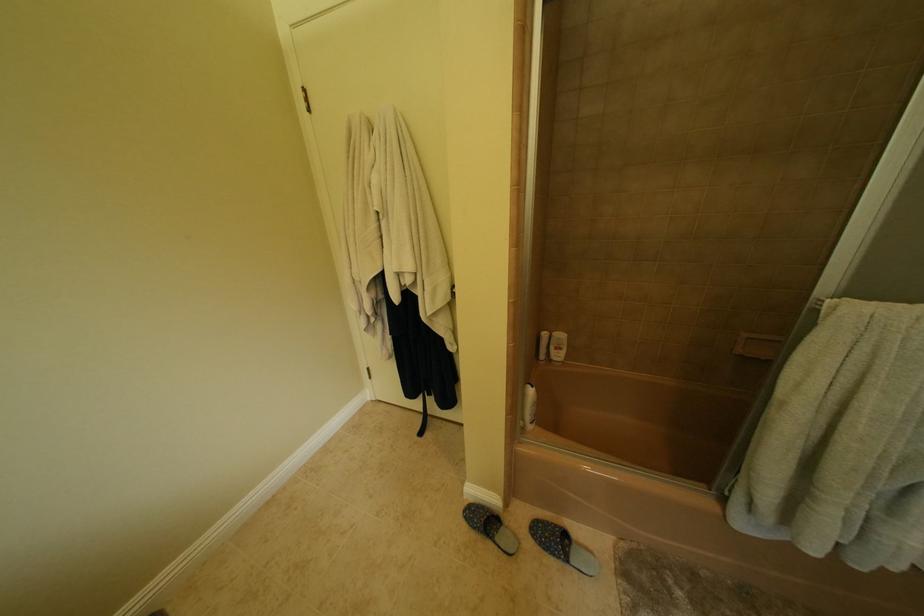
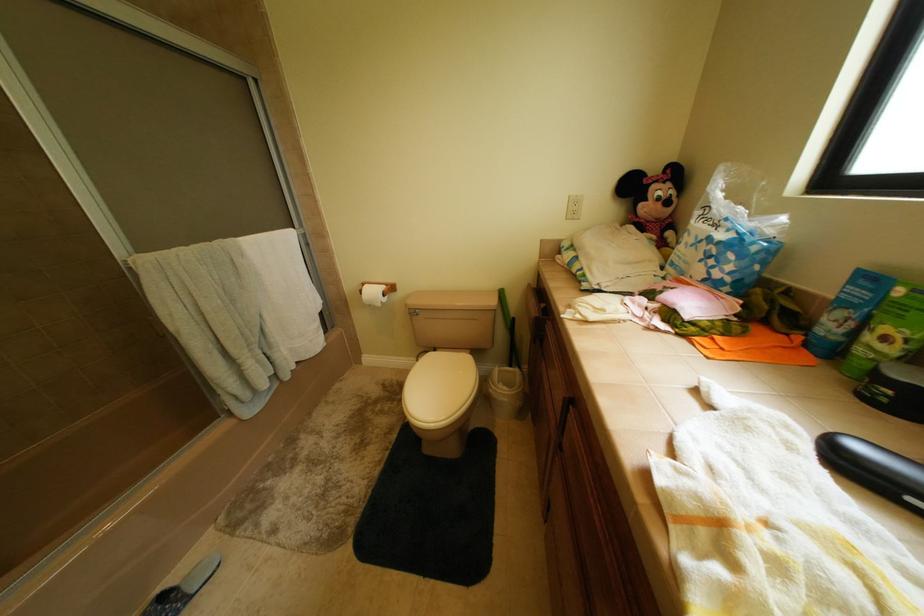
The images are taken continuously from a first-person perspective. In which direction is your viewpoint rotating?

The camera's rotation is toward right-down.